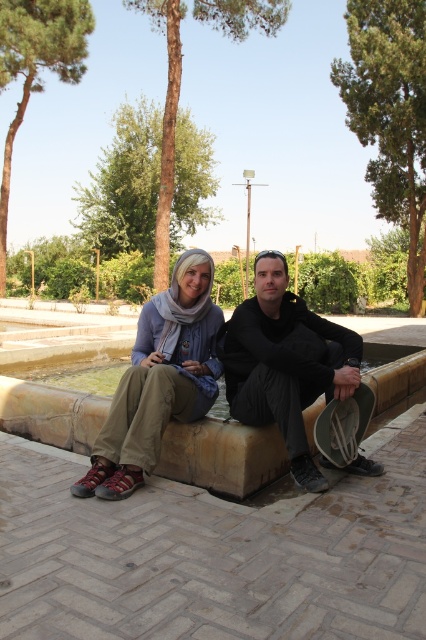
Question: Where is matte black clothing at center located in relation to black matte hat at center in the image?

Choices:
 (A) below
 (B) above

Answer: (A)

Question: Which of the following is the closest to the observer?

Choices:
 (A) matte black clothing at center
 (B) matte blue scarf at center
 (C) brown stone curb at center

Answer: (B)

Question: In this image, where is black matte hat at center located relative to matte blue scarf at center?

Choices:
 (A) left
 (B) right

Answer: (B)

Question: Can you confirm if matte blue scarf at center is smaller than brown stone curb at center?

Choices:
 (A) no
 (B) yes

Answer: (A)

Question: Estimate the real-world distances between objects in this image. Which object is farther from the black matte hat at center?

Choices:
 (A) matte blue scarf at center
 (B) brown stone curb at center
 (C) matte black clothing at center

Answer: (B)

Question: Estimate the real-world distances between objects in this image. Which object is closer to the matte blue scarf at center?

Choices:
 (A) brown stone curb at center
 (B) matte black clothing at center
 (C) black matte hat at center

Answer: (B)